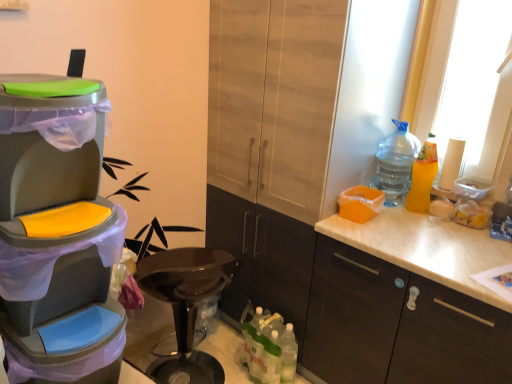
In order to click on translucent plastic bottles at lower center, which is the third bottle from right to left in this screenshot , I will do `click(263, 344)`.

The width and height of the screenshot is (512, 384). What do you see at coordinates (451, 163) in the screenshot? I see `white paper towel at right` at bounding box center [451, 163].

I want to click on yellow matte bottle at right, which is the 1th bottle in right-to-left order, so click(423, 177).

What do you see at coordinates (270, 143) in the screenshot? I see `matte wood cabinet at center, which is the 1th cabinetry in left-to-right order` at bounding box center [270, 143].

Identify the location of matte wood cabinet at center, which is the 1th cabinetry in left-to-right order. (270, 143).

The image size is (512, 384). In order to click on matte plastic trash can at left in this screenshot , I will do `click(57, 234)`.

Is clear plastic bottle at upper right, acting as the first bottle starting from the top, oriented towards white paper towel at right?

No.

Is clear plastic bottle at upper right, acting as the first bottle starting from the top, taller or shorter than white paper towel at right?

Clearly, clear plastic bottle at upper right, acting as the first bottle starting from the top, is taller compared to white paper towel at right.

Considering the relative sizes of clear plastic bottle at upper right, acting as the first bottle starting from the top, and white paper towel at right in the image provided, is clear plastic bottle at upper right, acting as the first bottle starting from the top, smaller than white paper towel at right?

Incorrect, clear plastic bottle at upper right, acting as the first bottle starting from the top, is not smaller in size than white paper towel at right.

Between clear plastic bottle at upper right, which is counted as the 3th bottle, starting from the bottom, and white paper towel at right, which one appears on the right side from the viewer's perspective?

white paper towel at right.

Can you confirm if matte plastic trash can at left is taller than matte wood cabinet at center, which is the 1th cabinetry in left-to-right order?

Incorrect, the height of matte plastic trash can at left is not larger of that of matte wood cabinet at center, which is the 1th cabinetry in left-to-right order.

The width and height of the screenshot is (512, 384). I want to click on appliance to the left of matte wood cabinet at center, which is the 2th cabinetry in right-to-left order, so click(57, 234).

Would you say matte plastic trash can at left is inside or outside matte wood cabinet at center, which is the 1th cabinetry in left-to-right order?

matte plastic trash can at left exists outside the volume of matte wood cabinet at center, which is the 1th cabinetry in left-to-right order.

Are matte plastic trash can at left and matte wood cabinet at center, which is the 1th cabinetry in left-to-right order, making contact?

No, matte plastic trash can at left is not making contact with matte wood cabinet at center, which is the 1th cabinetry in left-to-right order.

In terms of height, does white matte cabinet at right, arranged as the 1th cabinetry when viewed from the right, look taller or shorter compared to white paper towel at right?

white matte cabinet at right, arranged as the 1th cabinetry when viewed from the right, is taller than white paper towel at right.

Is white paper towel at right inside white matte cabinet at right, arranged as the 1th cabinetry when viewed from the right?

No, white paper towel at right is located outside of white matte cabinet at right, arranged as the 1th cabinetry when viewed from the right.

From a real-world perspective, is white matte cabinet at right, arranged as the 1th cabinetry when viewed from the right, located higher than white paper towel at right?

Incorrect, from a real-world perspective, white matte cabinet at right, arranged as the 1th cabinetry when viewed from the right, is lower than white paper towel at right.

From a real-world perspective, which is physically below, translucent plastic bottles at lower center, which appears as the third bottle when viewed from the top, or clear plastic bottle at upper right, positioned as the 2th bottle in right-to-left order?

From a 3D spatial view, translucent plastic bottles at lower center, which appears as the third bottle when viewed from the top, is below.

Image resolution: width=512 pixels, height=384 pixels. In order to click on the 2nd bottle positioned above the translucent plastic bottles at lower center, which is the third bottle from right to left (from the image's perspective) in this screenshot , I will do `click(395, 164)`.

From the image's perspective, is translucent plastic bottles at lower center, which is the third bottle from right to left, located above or below clear plastic bottle at upper right, positioned as the 2th bottle in right-to-left order?

translucent plastic bottles at lower center, which is the third bottle from right to left, is below clear plastic bottle at upper right, positioned as the 2th bottle in right-to-left order.

Is matte wood cabinet at center, which is the 2th cabinetry in right-to-left order, a part of white paper towel at right?

No, matte wood cabinet at center, which is the 2th cabinetry in right-to-left order, is located outside of white paper towel at right.

Can you confirm if white paper towel at right is bigger than matte wood cabinet at center, which is the 1th cabinetry in left-to-right order?

No, white paper towel at right is not bigger than matte wood cabinet at center, which is the 1th cabinetry in left-to-right order.

Image resolution: width=512 pixels, height=384 pixels. In order to click on the 1st cabinetry in front when counting from the white paper towel at right in this screenshot , I will do `click(270, 143)`.

Does point (445, 175) lie in front of point (246, 91)?

That is False.

Is white matte cabinet at right, which is the second cabinetry from left to right, not close to matte wood cabinet at center, which is the 2th cabinetry in right-to-left order?

Actually, white matte cabinet at right, which is the second cabinetry from left to right, and matte wood cabinet at center, which is the 2th cabinetry in right-to-left order, are a little close together.

Is white matte cabinet at right, which is the second cabinetry from left to right, positioned with its back to matte wood cabinet at center, which is the 1th cabinetry in left-to-right order?

No.

Relative to matte wood cabinet at center, which is the 1th cabinetry in left-to-right order, is white matte cabinet at right, arranged as the 1th cabinetry when viewed from the right, in front or behind?

Visually, white matte cabinet at right, arranged as the 1th cabinetry when viewed from the right, is located in front of matte wood cabinet at center, which is the 1th cabinetry in left-to-right order.

From the picture: Considering the relative sizes of white matte cabinet at right, arranged as the 1th cabinetry when viewed from the right, and matte plastic trash can at left in the image provided, is white matte cabinet at right, arranged as the 1th cabinetry when viewed from the right, bigger than matte plastic trash can at left?

Indeed, white matte cabinet at right, arranged as the 1th cabinetry when viewed from the right, has a larger size compared to matte plastic trash can at left.

Is white matte cabinet at right, which is the second cabinetry from left to right, oriented away from matte plastic trash can at left?

No, white matte cabinet at right, which is the second cabinetry from left to right, is not facing the opposite direction of matte plastic trash can at left.

Between point (307, 367) and point (42, 90), which one is positioned behind?

The point (307, 367) is farther.

The height and width of the screenshot is (384, 512). In order to click on the 2nd cabinetry positioned below the matte plastic trash can at left (from the image's perspective) in this screenshot , I will do `click(397, 325)`.

The height and width of the screenshot is (384, 512). Identify the location of the 1st bottle directly beneath the white paper towel at right (from a real-world perspective). [395, 164].

Find the location of a particular element. appliance located above the matte wood cabinet at center, which is the 1th cabinetry in left-to-right order (from the image's perspective) is located at coordinates (57, 234).

Which object lies nearer to the anchor point matte plastic trash can at left, white paper towel at right or matte wood cabinet at center, which is the 1th cabinetry in left-to-right order?

Among the two, matte wood cabinet at center, which is the 1th cabinetry in left-to-right order, is located nearer to matte plastic trash can at left.

Based on the photo, looking at the image, which one is located further to clear plastic bottle at upper right, positioned as the 2th bottle in right-to-left order, translucent plastic bottles at lower center, which is the 1th bottle from bottom to top, or matte plastic trash can at left?

Based on the image, matte plastic trash can at left appears to be further to clear plastic bottle at upper right, positioned as the 2th bottle in right-to-left order.

Looking at the image, which one is located closer to matte wood cabinet at center, which is the 1th cabinetry in left-to-right order, translucent plastic bottles at lower center, the first bottle when ordered from left to right, or matte plastic trash can at left?

The object closer to matte wood cabinet at center, which is the 1th cabinetry in left-to-right order, is translucent plastic bottles at lower center, the first bottle when ordered from left to right.

From the image, which object appears to be farther from matte plastic trash can at left, yellow matte bottle at right, the 2th bottle in the bottom-to-top sequence, or matte wood cabinet at center, which is the 1th cabinetry in left-to-right order?

Among the two, yellow matte bottle at right, the 2th bottle in the bottom-to-top sequence, is located further to matte plastic trash can at left.

Looking at the image, which one is located closer to translucent plastic bottles at lower center, which appears as the third bottle when viewed from the top, clear plastic bottle at upper right, which appears as the second bottle when viewed from the left, or matte wood cabinet at center, which is the 2th cabinetry in right-to-left order?

The object closer to translucent plastic bottles at lower center, which appears as the third bottle when viewed from the top, is matte wood cabinet at center, which is the 2th cabinetry in right-to-left order.

Looking at this image, based on their spatial positions, is white paper towel at right or matte plastic trash can at left further from clear plastic bottle at upper right, positioned as the 2th bottle in right-to-left order?

matte plastic trash can at left lies further to clear plastic bottle at upper right, positioned as the 2th bottle in right-to-left order, than the other object.

Which object lies nearer to the anchor point translucent plastic bottles at lower center, which is the third bottle from right to left, yellow matte bottle at right, the third bottle positioned from the left, or matte plastic trash can at left?

yellow matte bottle at right, the third bottle positioned from the left, lies closer to translucent plastic bottles at lower center, which is the third bottle from right to left, than the other object.

From the picture: Based on their spatial positions, is clear plastic bottle at upper right, positioned as the 2th bottle in right-to-left order, or white paper towel at right closer to white matte cabinet at right, arranged as the 1th cabinetry when viewed from the right?

The object closer to white matte cabinet at right, arranged as the 1th cabinetry when viewed from the right, is clear plastic bottle at upper right, positioned as the 2th bottle in right-to-left order.

The height and width of the screenshot is (384, 512). In order to click on bottle located between matte wood cabinet at center, which is the 2th cabinetry in right-to-left order, and yellow matte bottle at right, the 2th bottle in the bottom-to-top sequence, in the left-right direction in this screenshot , I will do `click(395, 164)`.

This screenshot has width=512, height=384. In order to click on cabinetry that lies between matte wood cabinet at center, which is the 1th cabinetry in left-to-right order, and translucent plastic bottles at lower center, which is the third bottle from right to left, from top to bottom in this screenshot , I will do `click(397, 325)`.

Identify the location of cabinetry located between matte plastic trash can at left and white matte cabinet at right, which is the second cabinetry from left to right, in the left-right direction. The image size is (512, 384). (270, 143).

This screenshot has width=512, height=384. Identify the location of cabinetry between yellow matte bottle at right, which is counted as the second bottle, starting from the top, and translucent plastic bottles at lower center, which is the 1th bottle from bottom to top, in the up-down direction. (397, 325).